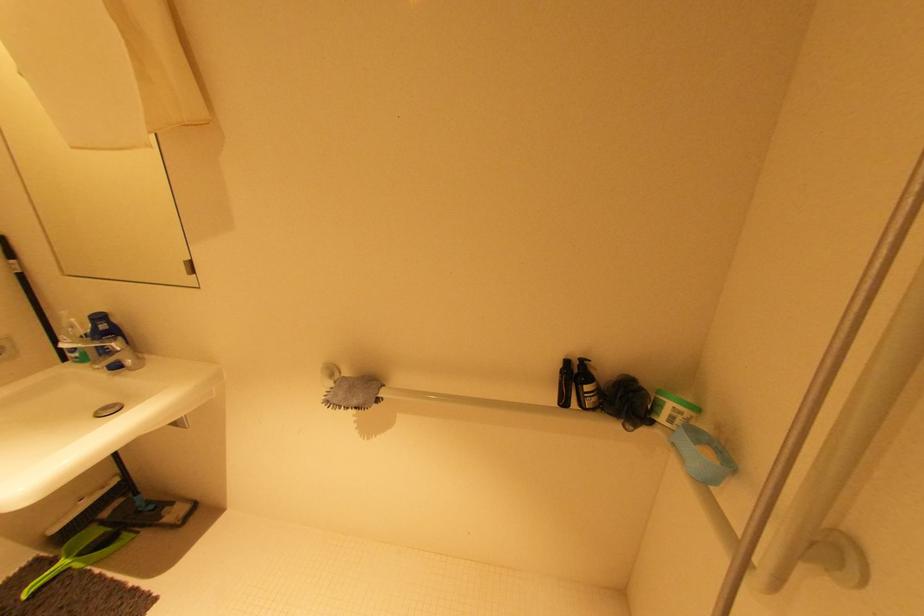
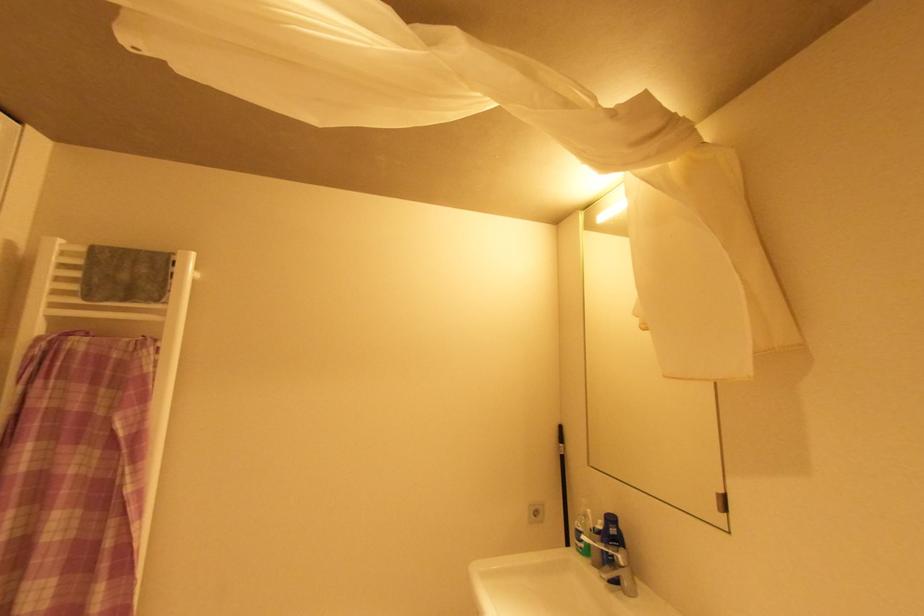
In the scene shown: The images are taken continuously from a first-person perspective. In which direction is your viewpoint rotating?

The rotation direction of the camera is left-up.